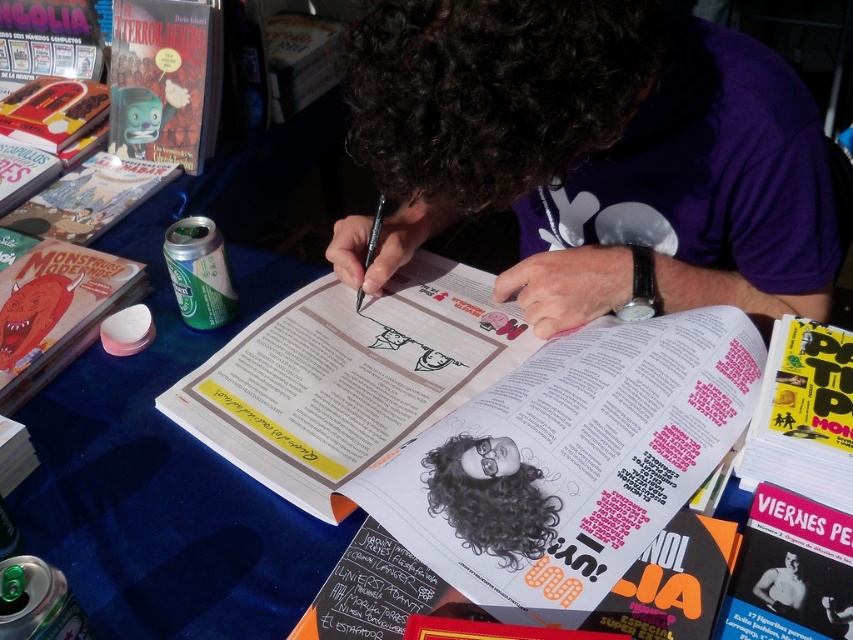
You are organizing a display and need to place the matte plastic toy at upper left and the smooth skin man at center on a shelf. Which object should you place first to ensure stability?

The matte plastic toy at upper left is bigger than the smooth skin man at center, so you should place the matte plastic toy at upper left first to ensure stability.

You are standing at the center of the table and want to place a small object between the two points labeled point (7, 369) and point (764, 573). Which point should you move toward first to ensure the object is placed correctly?

To place the object between the two points, you should first move toward point (764, 573) since point (7, 369) is behind it, meaning it is farther away from your current position at the table center.

Based on the scene description, can you determine if the matte plastic toy at upper left can fit entirely within the space occupied by the smooth skin man at center?

The matte plastic toy at upper left might be wider than smooth skin man at center, so it may not fit entirely within the space occupied by the smooth skin man at center.